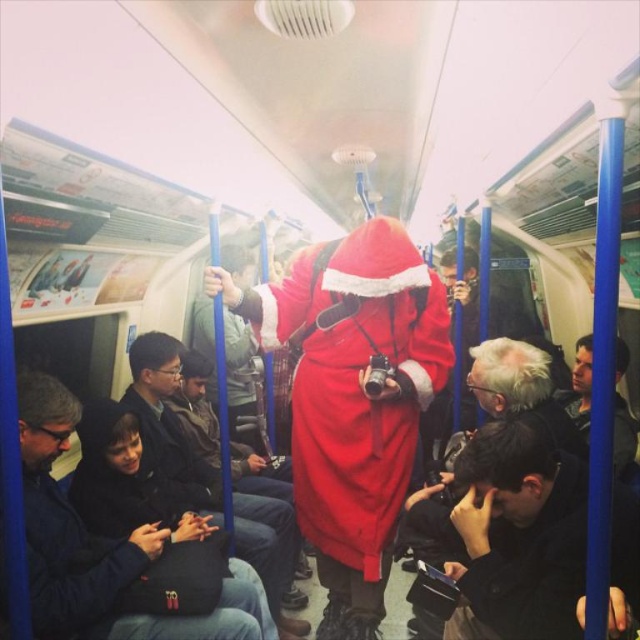
You are a delivery robot with a width of 1.2 meters. You are positioned near the dark brown leather jacket at lower right and need to move to the camera. Can you navigate the space between them without any obstacles?

The distance between the dark brown leather jacket at lower right and the camera is 1.45 meters. Since the robot is 1.2 meters wide, there is enough space to navigate between them without obstacles.

You are a passenger on the subway train and want to take a photo of the velvet red santa at center and the dark brown leather jacket at lower right. Since you are standing in the middle of the train, which object should you move towards to get a better angle? Explain your reasoning based on their positions.

The velvet red santa at center is positioned on the left side of the dark brown leather jacket at lower right. Since you are standing in the middle of the train, moving towards the left side would allow you to capture the velvet red santa at center more clearly, while moving towards the right side would provide a better view of the dark brown leather jacket at lower right.

From the picture: You are a passenger on the subway train and want to sit down. There are two seats available near the dark gray fabric jacket at lower left and the smooth black jacket at lower right. Which seat is wider?

The dark gray fabric jacket at lower left might be wider than smooth black jacket at lower right, so the seat near the dark gray fabric jacket at lower left could be wider.